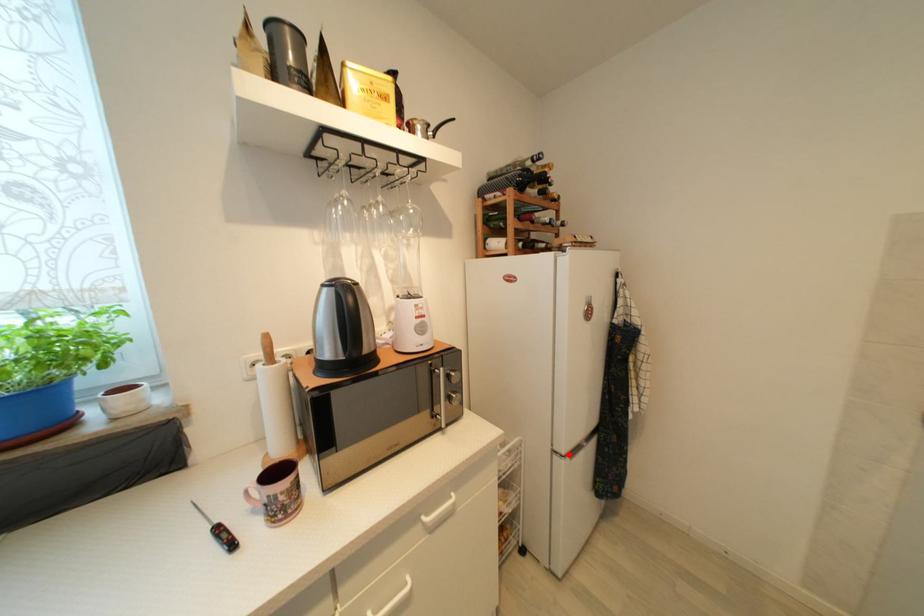
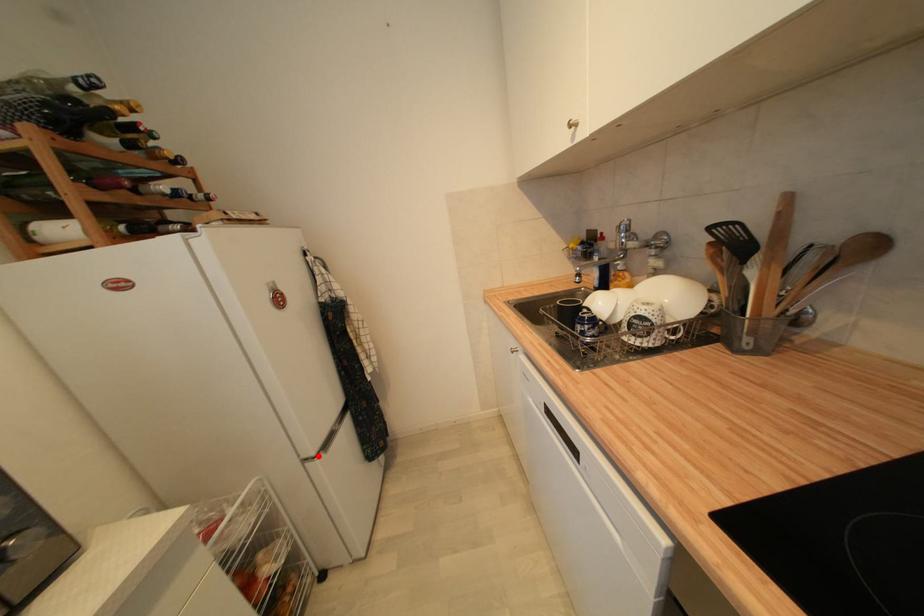
I am providing you with two images of the same scene from different viewpoints. A red point is marked on the first image and another point is marked on the second image. Does the point marked in image1 correspond to the same location as the one in image2?

Yes